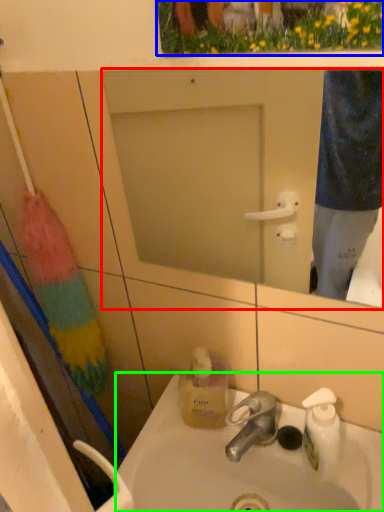
Question: Which object is positioned farthest from mirror (highlighted by a red box)? Select from flower (highlighted by a blue box) and sink (highlighted by a green box).

Choices:
 (A) flower
 (B) sink

Answer: (A)